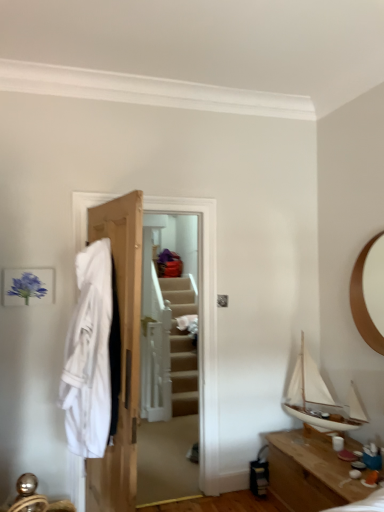
This screenshot has width=384, height=512. I want to click on empty space that is ontop of wooden door at center (from a real-world perspective), so click(148, 194).